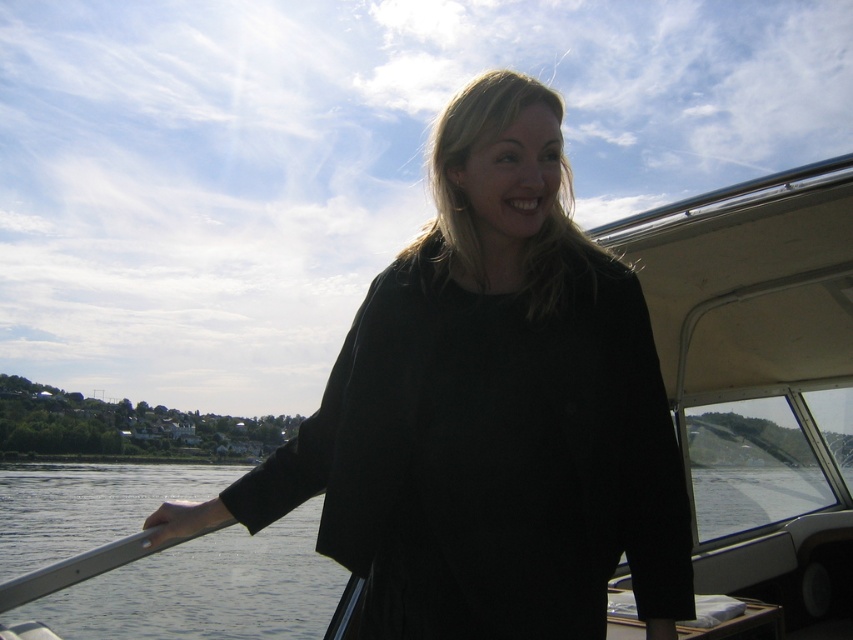
You are a photographer trying to capture the perfect shot of the black matte dress at center and the transparent water at lower left. Since you want to highlight both elements, you need to ensure they are both in focus. Given their heights, which object should you position closer to the camera to achieve this?

The black matte dress at center is taller than the transparent water at lower left, so positioning the black matte dress at center closer to the camera will help keep both in focus as the height difference might affect depth of field.

You are a photographer planning to take a portrait of the person wearing the black matte dress at center. To ensure the dress is well lit, where should you position the camera relative to the sunlight direction?

The black matte dress at center is located at point (x=489, y=412), so position the camera so the sunlight hits the dress directly to enhance its details and avoid shadows.

You are a photographer trying to capture the black matte dress at center and the transparent water at lower left in a single shot. Which object will appear larger in the photo?

The black matte dress at center will appear larger in the photo because it is closer to the viewer than the transparent water at lower left.